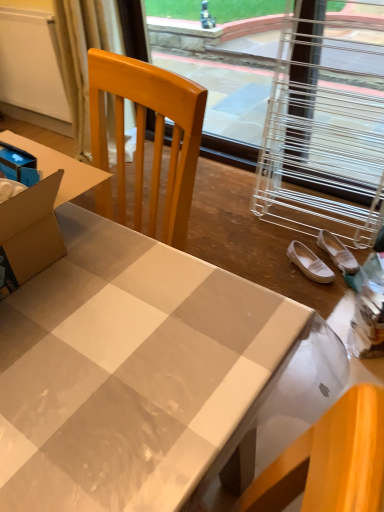
Question: From a real-world perspective, is metallic wire at upper right on white glossy desk at center?

Choices:
 (A) yes
 (B) no

Answer: (B)

Question: Are metallic wire at upper right and white glossy desk at center located far from each other?

Choices:
 (A) yes
 (B) no

Answer: (A)

Question: Does metallic wire at upper right have a lesser height compared to white glossy desk at center?

Choices:
 (A) no
 (B) yes

Answer: (B)

Question: Is metallic wire at upper right closer to camera compared to white glossy desk at center?

Choices:
 (A) no
 (B) yes

Answer: (A)

Question: Is metallic wire at upper right facing away from white glossy desk at center?

Choices:
 (A) no
 (B) yes

Answer: (A)

Question: Considering the relative positions of metallic wire at upper right and white glossy desk at center in the image provided, is metallic wire at upper right behind white glossy desk at center?

Choices:
 (A) no
 (B) yes

Answer: (B)

Question: From a real-world perspective, is white fabric shoe at lower right, marked as the second footwear in a left-to-right arrangement, positioned under metallic wire at upper right based on gravity?

Choices:
 (A) no
 (B) yes

Answer: (B)

Question: Does white fabric shoe at lower right, which ranks as the 1th footwear in right-to-left order, turn towards metallic wire at upper right?

Choices:
 (A) no
 (B) yes

Answer: (A)

Question: Is metallic wire at upper right located within white fabric shoe at lower right, which ranks as the 1th footwear in right-to-left order?

Choices:
 (A) no
 (B) yes

Answer: (A)

Question: Is metallic wire at upper right at the back of white fabric shoe at lower right, which ranks as the 1th footwear in right-to-left order?

Choices:
 (A) yes
 (B) no

Answer: (B)

Question: Is white fabric shoe at lower right, which ranks as the 1th footwear in right-to-left order, smaller than metallic wire at upper right?

Choices:
 (A) no
 (B) yes

Answer: (B)

Question: From the image's perspective, does white fabric shoe at lower right, which ranks as the 1th footwear in right-to-left order, appear lower than metallic wire at upper right?

Choices:
 (A) yes
 (B) no

Answer: (A)

Question: Is white suede shoes at lower right, marked as the 1th footwear in a left-to-right arrangement, bigger than white glossy desk at center?

Choices:
 (A) no
 (B) yes

Answer: (A)